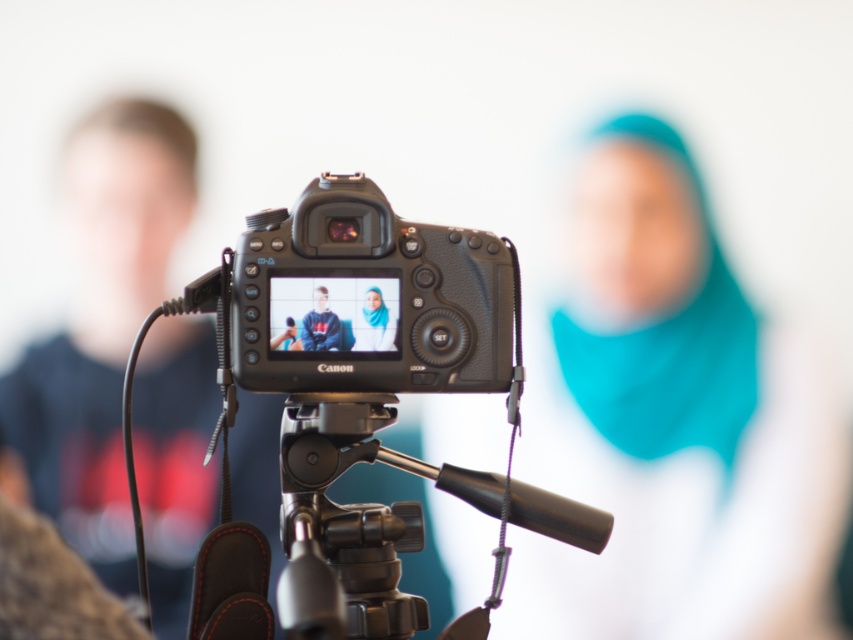
Question: Can you confirm if matte plastic camera at center is thinner than matte blue scarf at center?

Choices:
 (A) no
 (B) yes

Answer: (A)

Question: Does black matte/video camera at center appear under black matte canon camera at center?

Choices:
 (A) yes
 (B) no

Answer: (A)

Question: Is matte plastic camera at center positioned before matte blue scarf at center?

Choices:
 (A) yes
 (B) no

Answer: (A)

Question: Which object appears closest to the camera in this image?

Choices:
 (A) matte blue scarf at center
 (B) black matte canon camera at center
 (C) metallic silver tripod at center
 (D) matte plastic camera at center

Answer: (C)

Question: Which object is closer to the camera taking this photo?

Choices:
 (A) black matte canon camera at center
 (B) black matte/video camera at center
 (C) matte black hoodie at center
 (D) matte plastic camera at center

Answer: (B)

Question: Which point is closer to the camera taking this photo?

Choices:
 (A) (338, 348)
 (B) (349, 618)
 (C) (339, 531)

Answer: (A)